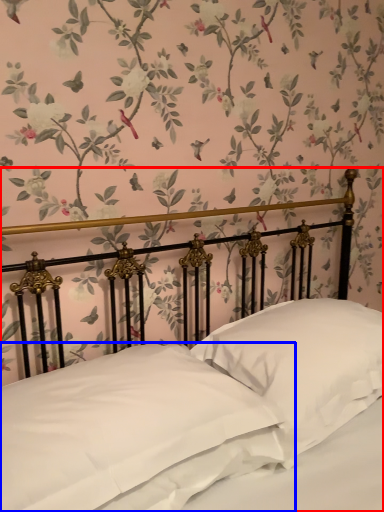
Question: Which object is further to the camera taking this photo, bed (highlighted by a red box) or pillow (highlighted by a blue box)?

Choices:
 (A) bed
 (B) pillow

Answer: (B)